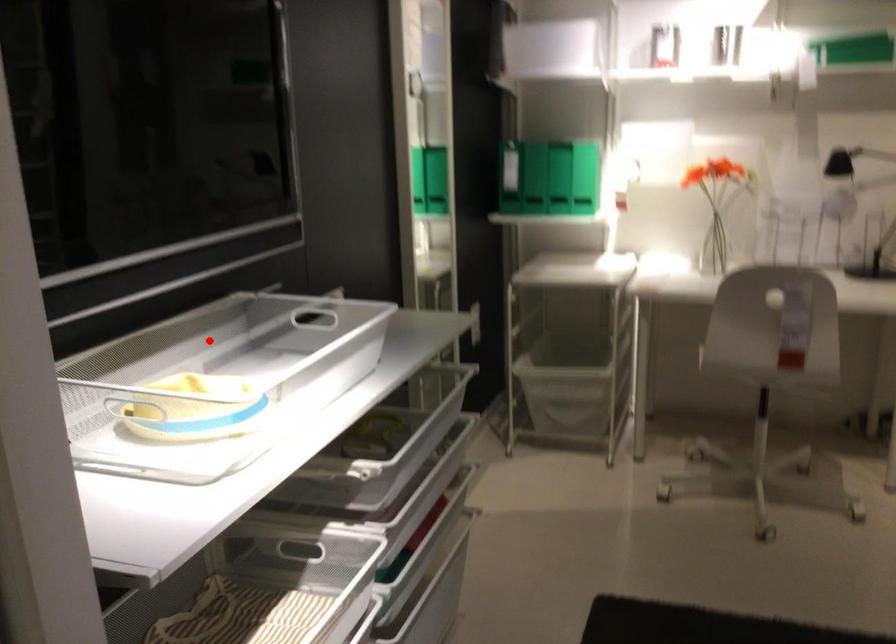
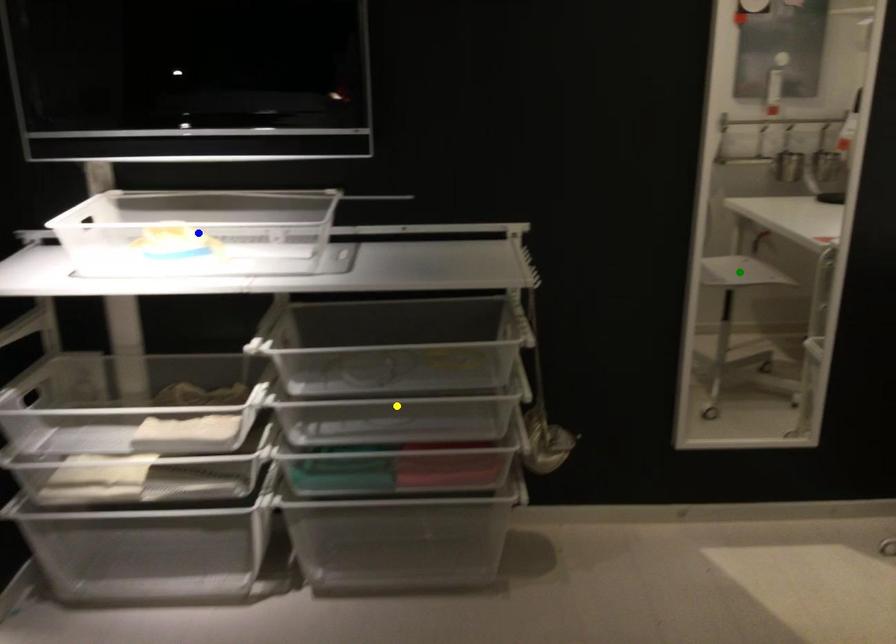
Question: I am providing you with two images of the same scene from different viewpoints. A red point is marked on the first image. You are given multiple points on the second image. Which spot in image 2 lines up with the point in image 1?

Choices:
 (A) yellow point
 (B) blue point
 (C) green point

Answer: (B)